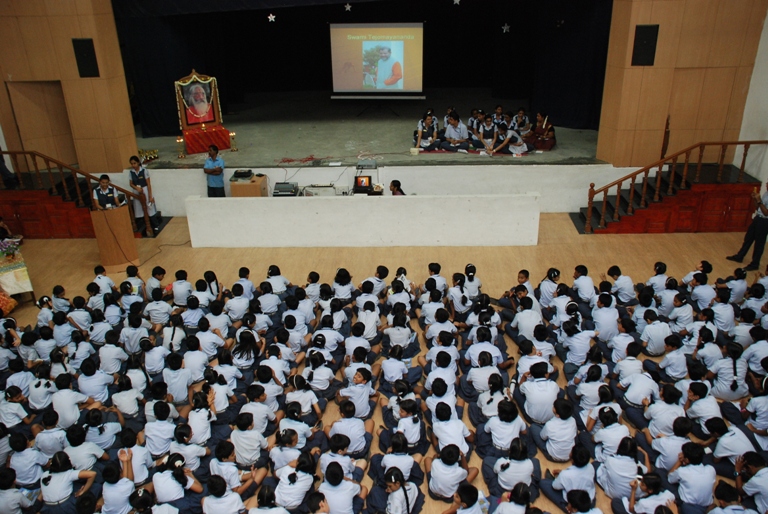
Where is `poster`? This screenshot has height=514, width=768. poster is located at coordinates (189, 100).